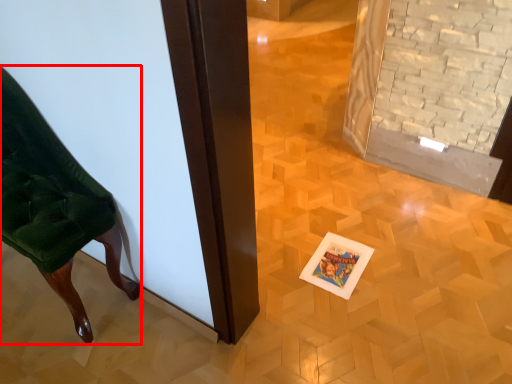
Question: In this image, where is furniture (annotated by the red box) located relative to postcard?

Choices:
 (A) left
 (B) right

Answer: (A)